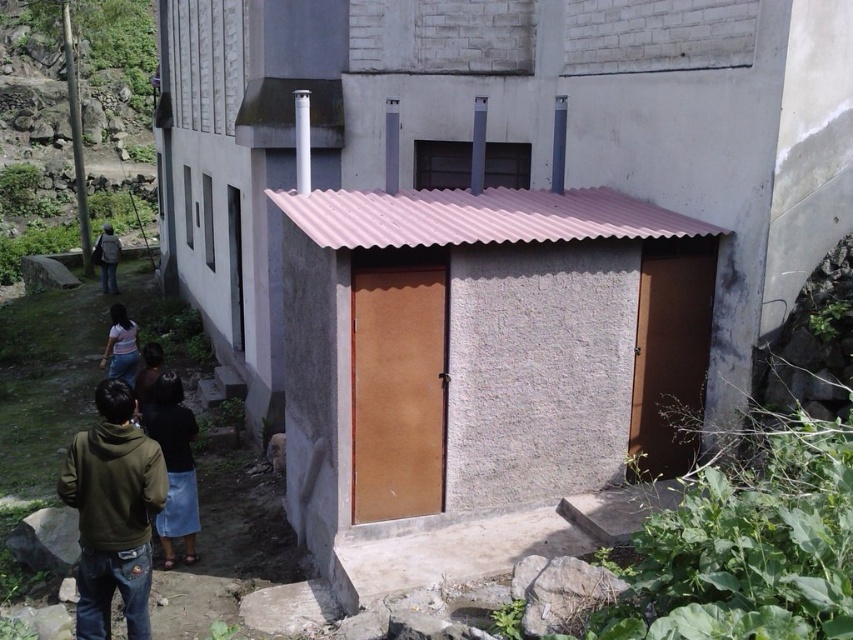
Question: Which of the following is the farthest from the observer?

Choices:
 (A) light blue denim skirt at lower left
 (B) green matte hoodie at lower left
 (C) dark blue denim skirt at lower center

Answer: (A)

Question: Can you confirm if dark blue denim skirt at lower center is bigger than dark brown hair at lower center?

Choices:
 (A) yes
 (B) no

Answer: (B)

Question: Observing the image, what is the correct spatial positioning of light blue denim skirt at lower left in reference to dark brown hair at lower center?

Choices:
 (A) right
 (B) left

Answer: (B)

Question: Can you confirm if light blue denim skirt at lower left is positioned to the left of dark blue jeans at left?

Choices:
 (A) no
 (B) yes

Answer: (A)

Question: Which point is closer to the camera?

Choices:
 (A) dark blue denim skirt at lower center
 (B) light blue denim skirt at lower left
 (C) dark brown hair at lower center
 (D) green matte hoodie at lower left

Answer: (D)

Question: Which point is closer to the camera taking this photo?

Choices:
 (A) (102, 284)
 (B) (114, 360)
 (C) (126, 470)

Answer: (C)